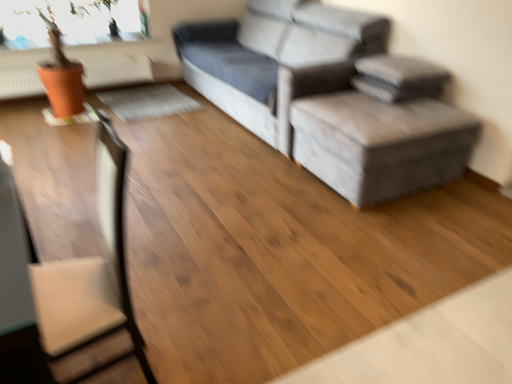
Identify the location of vacant area located to the right-hand side of brown leather swivel chair at left. This screenshot has width=512, height=384. point(206,347).